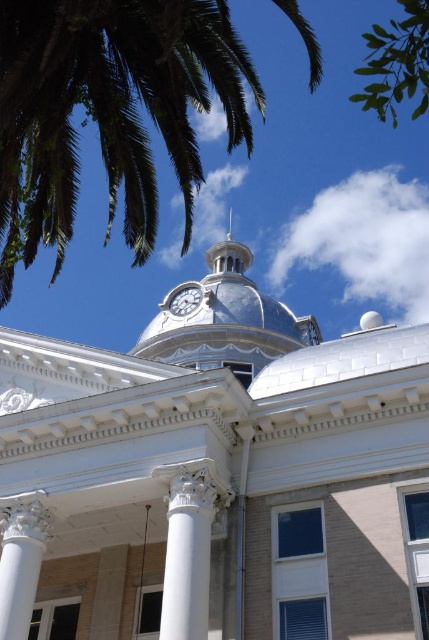
Question: Considering the relative positions of green leafy tree at upper right and white glossy clock at upper center in the image provided, where is green leafy tree at upper right located with respect to white glossy clock at upper center?

Choices:
 (A) left
 (B) right

Answer: (B)

Question: Which object is farther from the camera taking this photo?

Choices:
 (A) white marble column at lower left
 (B) white glossy clock at upper center

Answer: (B)

Question: Is white glossy spire at upper center smaller than white glossy clock at upper center?

Choices:
 (A) yes
 (B) no

Answer: (B)

Question: Is white marble column at lower left smaller than white glossy spire at upper center?

Choices:
 (A) yes
 (B) no

Answer: (A)

Question: Which of the following is the closest to the observer?

Choices:
 (A) (18, 634)
 (B) (221, 42)
 (C) (172, 301)

Answer: (B)

Question: Which of the following is the closest to the observer?

Choices:
 (A) (196, 307)
 (B) (72, 113)

Answer: (A)